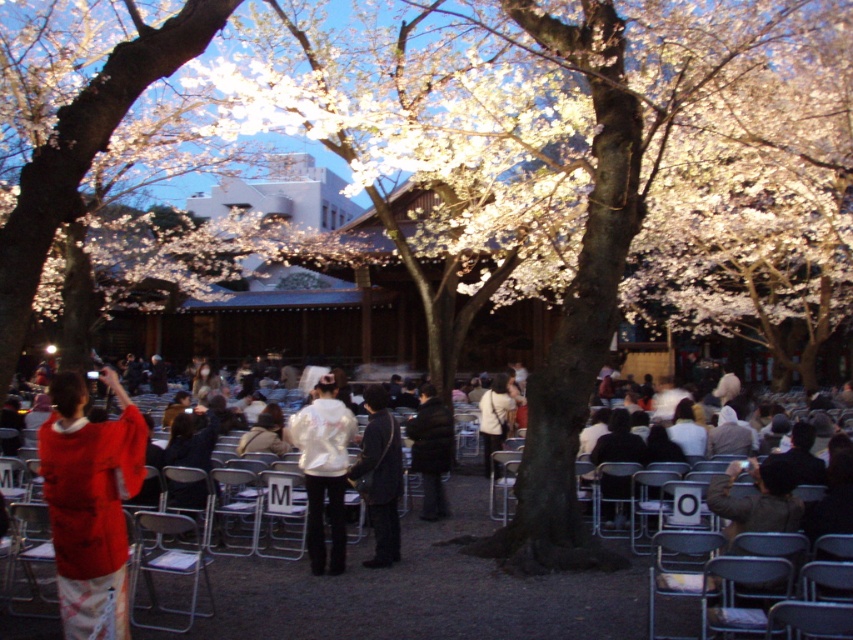
Question: Does silky red kimono at left appear on the right side of white matte jacket at center?

Choices:
 (A) no
 (B) yes

Answer: (A)

Question: Does silky red kimono at left lie in front of black matte jacket at center?

Choices:
 (A) yes
 (B) no

Answer: (A)

Question: Is the position of silky red kimono at left more distant than that of black matte jacket at center?

Choices:
 (A) yes
 (B) no

Answer: (B)

Question: Which of the following is the farthest from the observer?

Choices:
 (A) (434, 401)
 (B) (579, 576)

Answer: (A)

Question: Which of the following is the closest to the observer?

Choices:
 (A) (355, 548)
 (B) (335, 492)
 (C) (376, 410)
 (D) (492, 385)

Answer: (B)

Question: Considering the real-world distances, which object is closest to the black matte jacket at center?

Choices:
 (A) white fabric jacket at center
 (B) red fabric kimono at left
 (C) white matte jacket at center
 (D) metallic gray chair at lower right

Answer: (A)